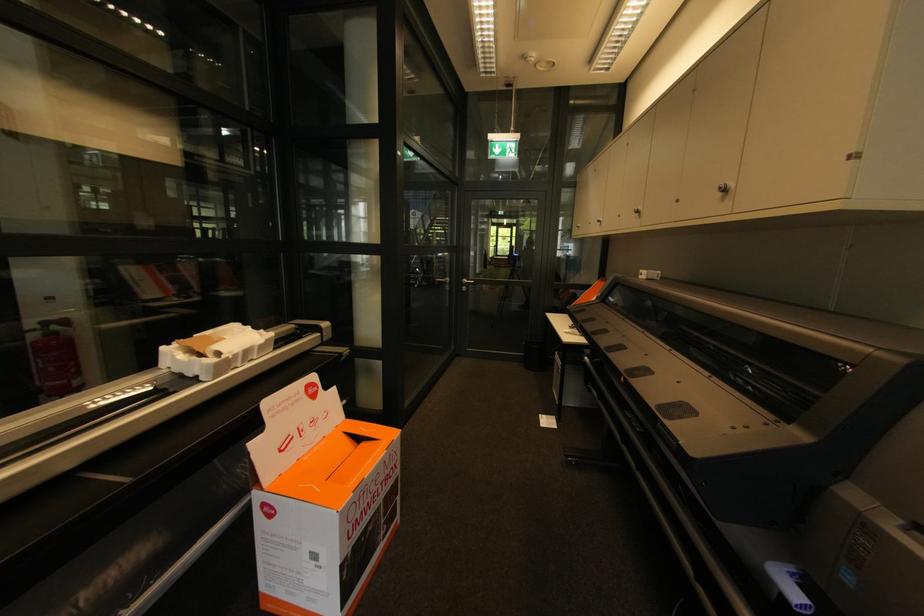
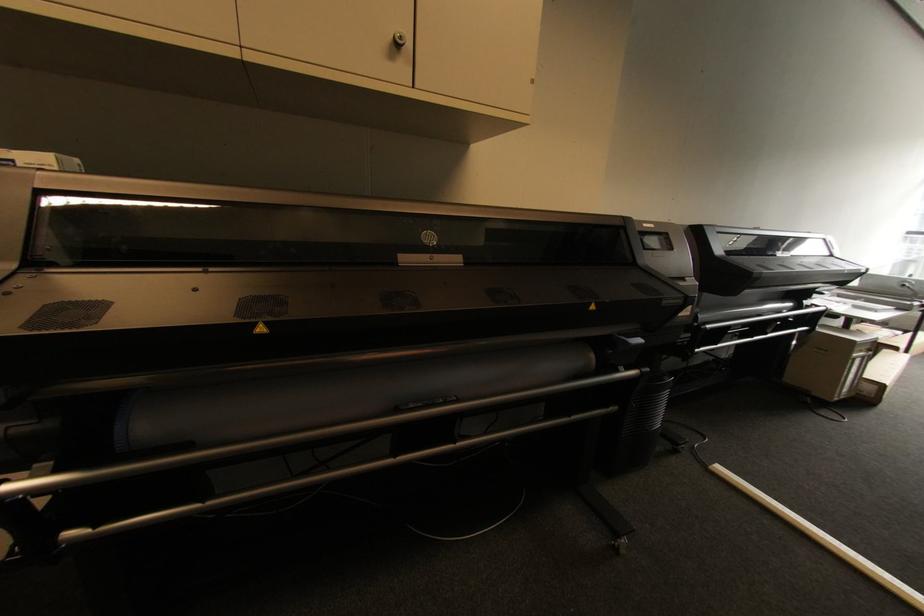
The point at (723, 188) is marked in the first image. Where is the corresponding point in the second image?

(405, 38)